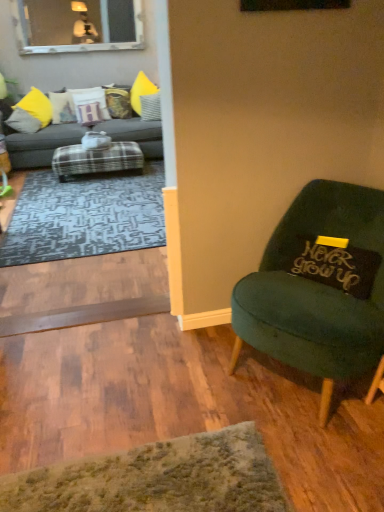
Question: Considering the positions of black fabric pillow at right, arranged as the sixth pillow when viewed from the back, and matte yellow pillow at left, the fifth pillow in the back-to-front sequence, in the image, is black fabric pillow at right, arranged as the sixth pillow when viewed from the back, taller or shorter than matte yellow pillow at left, the fifth pillow in the back-to-front sequence,?

Choices:
 (A) short
 (B) tall

Answer: (A)

Question: From a real-world perspective, is black fabric pillow at right, which is counted as the 1th pillow, starting from the bottom, positioned above or below matte yellow pillow at left, which appears as the second pillow when ordered from the bottom?

Choices:
 (A) below
 (B) above

Answer: (A)

Question: Estimate the real-world distances between objects in this image. Which object is closer to the white fabric pillow at upper center, placed as the third pillow when sorted from bottom to top?

Choices:
 (A) velvet green chair at right
 (B) plush purple pillow at upper left, which ranks as the 2th pillow in back-to-front order
 (C) matte yellow pillow at upper left, the second pillow in the left-to-right sequence
 (D) velvet yellow pillow at center, which is counted as the 6th pillow, starting from the bottom
 (E) matte yellow pillow at left, the fifth pillow in the back-to-front sequence

Answer: (D)

Question: Estimate the real-world distances between objects in this image. Which object is farther from the black fabric pillow at right, arranged as the sixth pillow when viewed from the back?

Choices:
 (A) velvet yellow pillow at center, the first pillow from the top
 (B) clear glass window at upper left
 (C) velvet green chair at right
 (D) matte yellow pillow at upper left, placed as the fourth pillow when sorted from front to back
 (E) plush purple pillow at upper left, placed as the third pillow when sorted from top to bottom

Answer: (B)